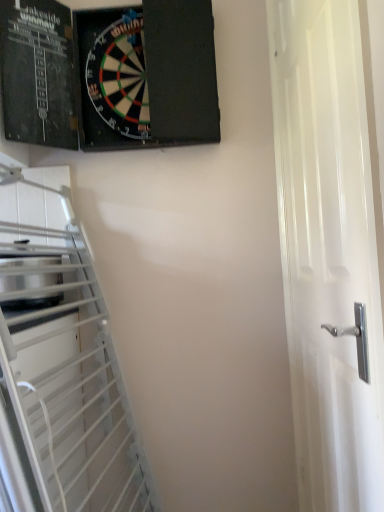
The image size is (384, 512). In order to click on black matte dartboard at upper left in this screenshot , I will do `click(146, 75)`.

What do you see at coordinates (146, 75) in the screenshot?
I see `black matte dartboard at upper left` at bounding box center [146, 75].

What do you see at coordinates (328, 250) in the screenshot?
I see `white glossy door at right` at bounding box center [328, 250].

I want to click on white glossy door at right, so click(x=328, y=250).

The width and height of the screenshot is (384, 512). I want to click on black matte dartboard at upper left, so click(x=146, y=75).

Looking at this image, which object is positioned more to the right, white glossy door at right or black matte dartboard at upper left?

white glossy door at right is more to the right.

Does white glossy door at right come in front of black matte dartboard at upper left?

Yes, white glossy door at right is closer to the camera.

Does point (304, 36) appear closer or farther from the camera than point (165, 126)?

Clearly, point (304, 36) is closer to the camera than point (165, 126).

From the image's perspective, is white glossy door at right on top of black matte dartboard at upper left?

No, from the image's perspective, white glossy door at right is not above black matte dartboard at upper left.

From a real-world perspective, between white glossy door at right and black matte dartboard at upper left, who is vertically lower?

In real-world perspective, white glossy door at right is lower.

Considering the relative sizes of white glossy door at right and black matte dartboard at upper left in the image provided, is white glossy door at right wider than black matte dartboard at upper left?

No, white glossy door at right is not wider than black matte dartboard at upper left.

Does white glossy door at right have a greater height compared to black matte dartboard at upper left?

Indeed, white glossy door at right has a greater height compared to black matte dartboard at upper left.

Who is smaller, white glossy door at right or black matte dartboard at upper left?

With smaller size is black matte dartboard at upper left.

Is black matte dartboard at upper left a part of white glossy door at right?

No, white glossy door at right does not contain black matte dartboard at upper left.

Is white glossy door at right directly adjacent to black matte dartboard at upper left?

No, white glossy door at right is not with black matte dartboard at upper left.

Is white glossy door at right looking in the opposite direction of black matte dartboard at upper left?

No, white glossy door at right is not facing the opposite direction of black matte dartboard at upper left.

I want to click on bulletin board behind the white glossy door at right, so click(x=146, y=75).

Is black matte dartboard at upper left to the right of white glossy door at right from the viewer's perspective?

No.

Relative to white glossy door at right, is black matte dartboard at upper left in front or behind?

black matte dartboard at upper left is positioned farther from the viewer than white glossy door at right.

Is point (193, 14) closer to camera compared to point (291, 223)?

No, (193, 14) is further to viewer.

From the image's perspective, which is above, black matte dartboard at upper left or white glossy door at right?

black matte dartboard at upper left appears higher in the image.

From a real-world perspective, is black matte dartboard at upper left below white glossy door at right?

No, from a real-world perspective, black matte dartboard at upper left is not beneath white glossy door at right.

Considering the sizes of objects black matte dartboard at upper left and white glossy door at right in the image provided, who is wider, black matte dartboard at upper left or white glossy door at right?

Wider between the two is black matte dartboard at upper left.

From the picture: Considering the relative sizes of black matte dartboard at upper left and white glossy door at right in the image provided, is black matte dartboard at upper left taller than white glossy door at right?

In fact, black matte dartboard at upper left may be shorter than white glossy door at right.

Who is smaller, black matte dartboard at upper left or white glossy door at right?

Smaller between the two is black matte dartboard at upper left.

Is black matte dartboard at upper left not inside white glossy door at right?

Yes, black matte dartboard at upper left is outside of white glossy door at right.

Are black matte dartboard at upper left and white glossy door at right located far from each other?

That's not correct — black matte dartboard at upper left is a little close to white glossy door at right.

Could you tell me if black matte dartboard at upper left is turned towards white glossy door at right?

No, black matte dartboard at upper left is not aimed at white glossy door at right.

Can you tell me how much black matte dartboard at upper left and white glossy door at right differ in facing direction?

88.7 degrees.

How far apart are black matte dartboard at upper left and white glossy door at right?

21.87 inches.

You are a GUI agent. You are given a task and a screenshot of the screen. Output one action in this format:
    pyautogui.click(x=<x>, y=<y>)
    Task: Click on the bulletin board that is behind the white glossy door at right
    Image resolution: width=384 pixels, height=512 pixels.
    Given the screenshot: What is the action you would take?
    pyautogui.click(x=146, y=75)

Identify the location of bulletin board lying on the left of white glossy door at right. This screenshot has width=384, height=512. (146, 75).

What are the coordinates of `bulletin board above the white glossy door at right (from the image's perspective)` in the screenshot? It's located at (146, 75).